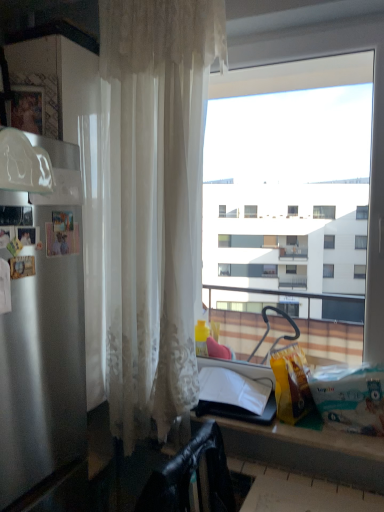
The width and height of the screenshot is (384, 512). Find the location of `free spot above transparent glass window at center (from a real-world perspective)`. free spot above transparent glass window at center (from a real-world perspective) is located at coordinates (296, 38).